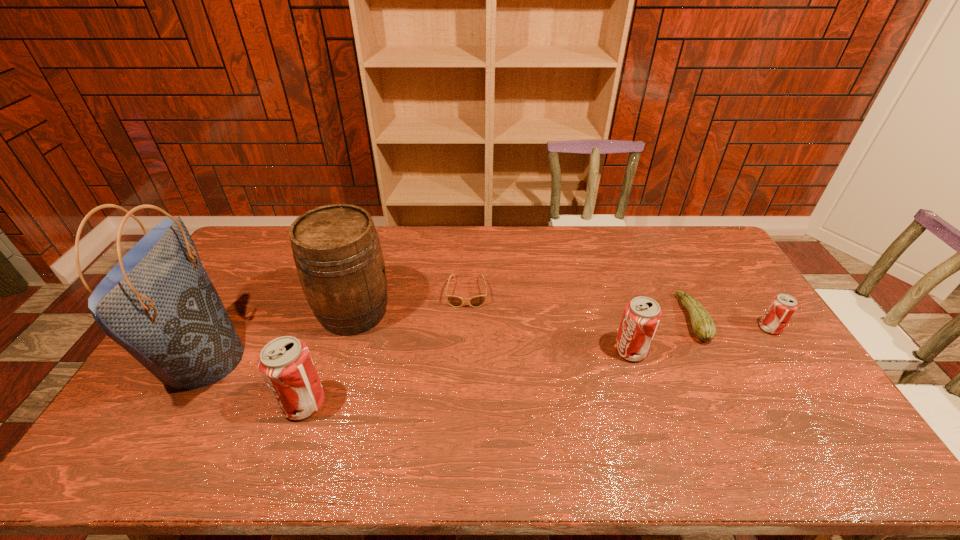
This screenshot has width=960, height=540. Find the location of `free region at the near left corner`. free region at the near left corner is located at coordinates (179, 401).

At what (x,y) coordinates should I click in order to perform the action: click on free space between the sunglasses and the cider. Please return your answer as a coordinate pair (x, y). Looking at the image, I should click on (410, 302).

You are a GUI agent. You are given a task and a screenshot of the screen. Output one action in this format:
    pyautogui.click(x=<x>, y=<y>)
    Task: Click on the free space between the tallest object and the nearest soda can
    
    Given the screenshot: What is the action you would take?
    pyautogui.click(x=253, y=381)

You are a GUI agent. You are given a task and a screenshot of the screen. Output one action in this format:
    pyautogui.click(x=<x>, y=<y>)
    Task: Click on the empty location between the second soda can from left to right and the cider
    The width and height of the screenshot is (960, 540).
    Given the screenshot: What is the action you would take?
    pyautogui.click(x=492, y=331)

Locate an element on the screen. The height and width of the screenshot is (540, 960). blank region between the second object from right to left and the sixth shortest object is located at coordinates (523, 315).

This screenshot has height=540, width=960. I want to click on blank region between the rightmost object and the sixth shortest object, so [x=562, y=320].

At what (x,y) coordinates should I click in order to perform the action: click on vacant space that's between the cider and the sixth tallest object. Please return your answer as a coordinate pair (x, y). Looking at the image, I should click on (523, 315).

Find the location of a particular element. vacant area between the sixth tallest object and the fifth object from left to right is located at coordinates (661, 335).

The image size is (960, 540). What are the coordinates of `vacant area that lies between the fourth object from right to left and the second farthest soda can` in the screenshot? It's located at (548, 321).

This screenshot has height=540, width=960. I want to click on vacant area that lies between the leftmost object and the nearest soda can, so click(253, 381).